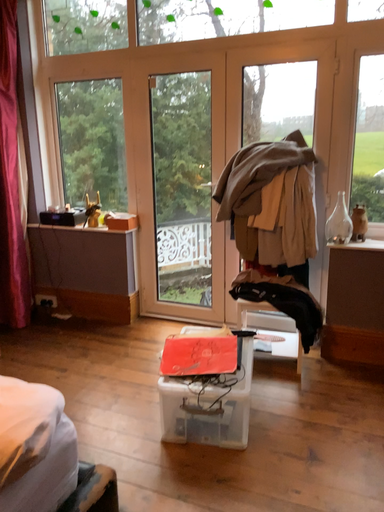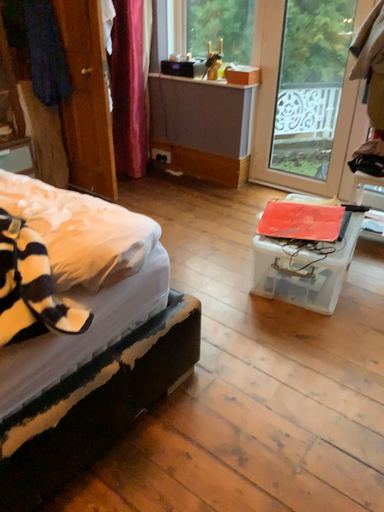
Question: Which way did the camera rotate in the video?

Choices:
 (A) rotated right
 (B) rotated left

Answer: (B)